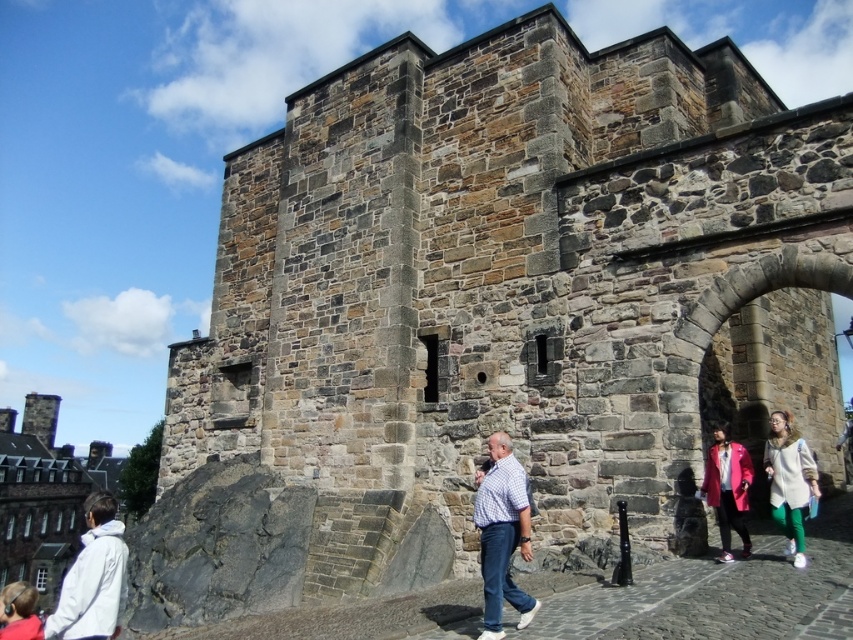
Question: Is white fuzzy coat at lower right below pink matte coat at lower right?

Choices:
 (A) no
 (B) yes

Answer: (A)

Question: Which object is positioned farthest from the light brown leather jacket at lower left?

Choices:
 (A) checkered fabric shirt at center
 (B) pink matte coat at lower right
 (C) white matte jacket at lower left
 (D) white fuzzy coat at lower right

Answer: (D)

Question: Can you confirm if white matte jacket at lower left is positioned to the left of light brown leather jacket at lower left?

Choices:
 (A) no
 (B) yes

Answer: (A)

Question: Which object is positioned closest to the stone archway at center right?

Choices:
 (A) checkered fabric shirt at center
 (B) white matte jacket at lower left
 (C) white fuzzy coat at lower right
 (D) pink matte coat at lower right

Answer: (D)

Question: Which object is farther from the camera taking this photo?

Choices:
 (A) pink matte coat at lower right
 (B) light brown leather jacket at lower left
 (C) stone archway at center right
 (D) white fuzzy coat at lower right

Answer: (D)

Question: Observing the image, what is the correct spatial positioning of white fuzzy coat at lower right in reference to pink matte coat at lower right?

Choices:
 (A) right
 (B) left

Answer: (A)